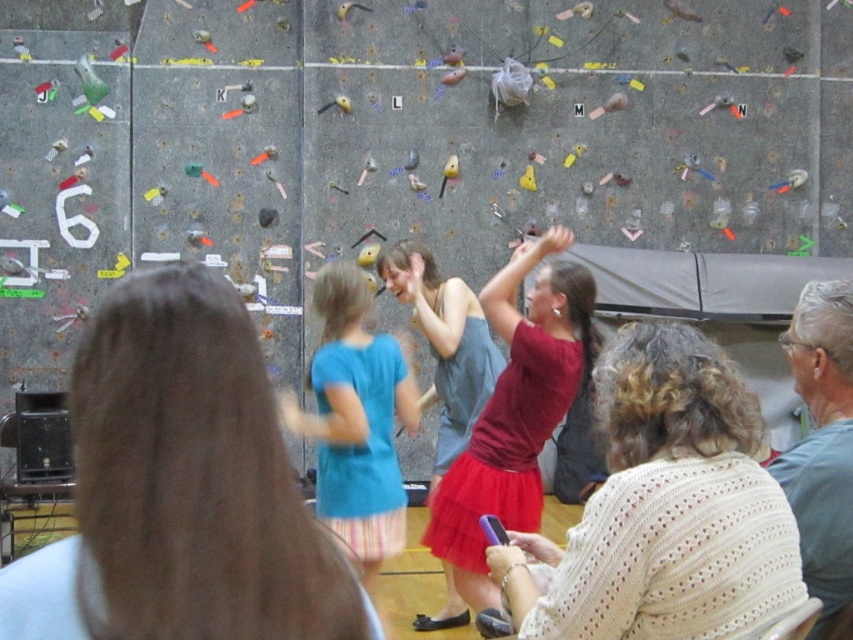
Question: Estimate the real-world distances between objects in this image. Which object is farther from the matte red skirt at center?

Choices:
 (A) gray fabric at upper right
 (B) blue cotton shirt at center

Answer: (A)

Question: Is matte red skirt at center below gray fabric at upper right?

Choices:
 (A) yes
 (B) no

Answer: (A)

Question: Does blue cotton shirt at center have a smaller size compared to gray fabric at upper right?

Choices:
 (A) no
 (B) yes

Answer: (A)

Question: Which point is closer to the camera taking this photo?

Choices:
 (A) (578, 317)
 (B) (370, 499)
 (C) (799, 461)

Answer: (C)

Question: Which object appears closest to the camera in this image?

Choices:
 (A) gray fabric at upper right
 (B) blue cotton shirt at center
 (C) matte red skirt at center

Answer: (A)

Question: Is matte red skirt at center smaller than blue cotton shirt at center?

Choices:
 (A) yes
 (B) no

Answer: (B)